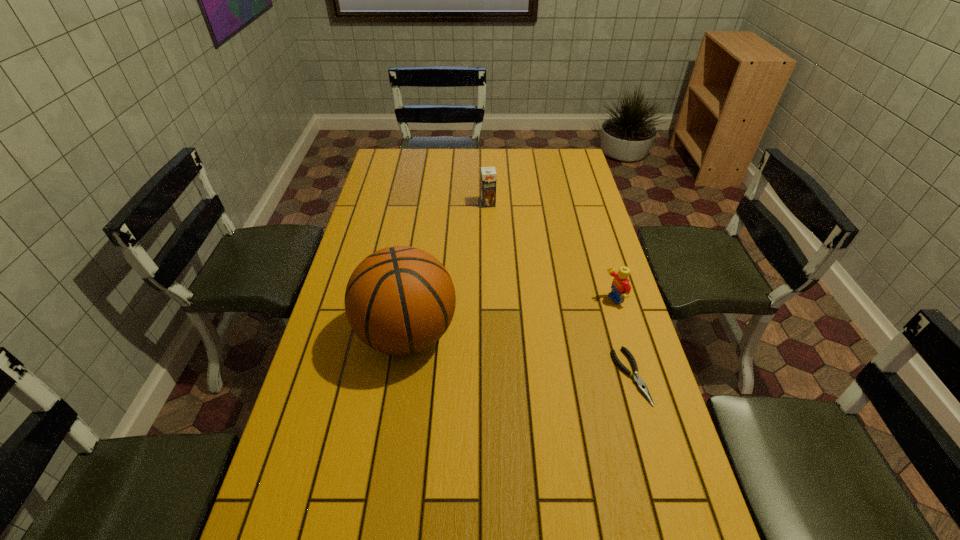
Locate an element on the screen. The image size is (960, 540). free space located on the face of the second shortest object is located at coordinates (485, 347).

Where is `vacant area situated on the front label of the farthest object`? This screenshot has height=540, width=960. vacant area situated on the front label of the farthest object is located at coordinates (495, 235).

You are a GUI agent. You are given a task and a screenshot of the screen. Output one action in this format:
    pyautogui.click(x=<x>, y=<y>)
    Task: Click on the free space located 0.120m on the front label of the farthest object
    The width and height of the screenshot is (960, 540).
    Given the screenshot: What is the action you would take?
    pyautogui.click(x=493, y=227)

Where is `vacant region located 0.330m on the front label of the farthest object`? The height and width of the screenshot is (540, 960). vacant region located 0.330m on the front label of the farthest object is located at coordinates (502, 265).

The height and width of the screenshot is (540, 960). What are the coordinates of `object that is at the left edge` in the screenshot? It's located at (400, 300).

At what (x,y) coordinates should I click in order to perform the action: click on pliers at the right edge. Please return your answer as a coordinate pair (x, y). The height and width of the screenshot is (540, 960). Looking at the image, I should click on (642, 387).

Identify the location of Lego that is at the right edge. pyautogui.click(x=621, y=288).

The image size is (960, 540). Find the location of `vacant area at the far edge of the desktop`. vacant area at the far edge of the desktop is located at coordinates (441, 177).

This screenshot has height=540, width=960. I want to click on vacant point at the near edge, so click(x=426, y=517).

The image size is (960, 540). I want to click on vacant space at the left edge of the desktop, so click(403, 179).